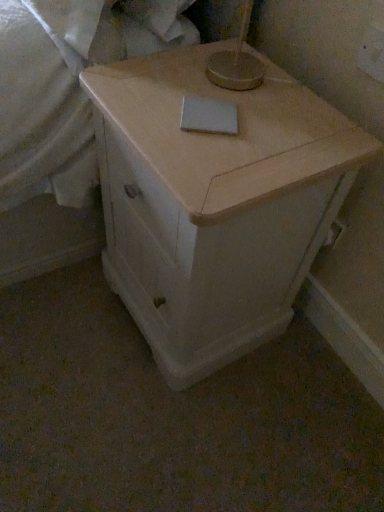
Question: Is light wood cabinet at center closer to camera compared to white matte sheet at upper center?

Choices:
 (A) no
 (B) yes

Answer: (B)

Question: Is light wood cabinet at center placed right next to white matte sheet at upper center?

Choices:
 (A) no
 (B) yes

Answer: (A)

Question: From a real-world perspective, is light wood cabinet at center positioned under white matte sheet at upper center based on gravity?

Choices:
 (A) no
 (B) yes

Answer: (B)

Question: Does light wood cabinet at center have a lesser height compared to white matte sheet at upper center?

Choices:
 (A) no
 (B) yes

Answer: (A)

Question: From the image's perspective, is light wood cabinet at center below white matte sheet at upper center?

Choices:
 (A) yes
 (B) no

Answer: (A)

Question: Is light wood cabinet at center at the right side of white matte sheet at upper center?

Choices:
 (A) yes
 (B) no

Answer: (A)

Question: Is white matte sheet at upper center smaller than light wood cabinet at center?

Choices:
 (A) no
 (B) yes

Answer: (B)

Question: Considering the relative positions of white matte sheet at upper center and light wood cabinet at center in the image provided, is white matte sheet at upper center behind light wood cabinet at center?

Choices:
 (A) yes
 (B) no

Answer: (A)

Question: Does white matte sheet at upper center appear on the left side of light wood cabinet at center?

Choices:
 (A) no
 (B) yes

Answer: (B)

Question: From a real-world perspective, does white matte sheet at upper center stand above light wood cabinet at center?

Choices:
 (A) yes
 (B) no

Answer: (A)

Question: Considering the relative sizes of white matte sheet at upper center and light wood cabinet at center in the image provided, is white matte sheet at upper center thinner than light wood cabinet at center?

Choices:
 (A) no
 (B) yes

Answer: (B)

Question: Could light wood cabinet at center be considered to be inside white matte sheet at upper center?

Choices:
 (A) no
 (B) yes

Answer: (A)

Question: Is light wood cabinet at center not inside white matte notepad at center?

Choices:
 (A) yes
 (B) no

Answer: (A)